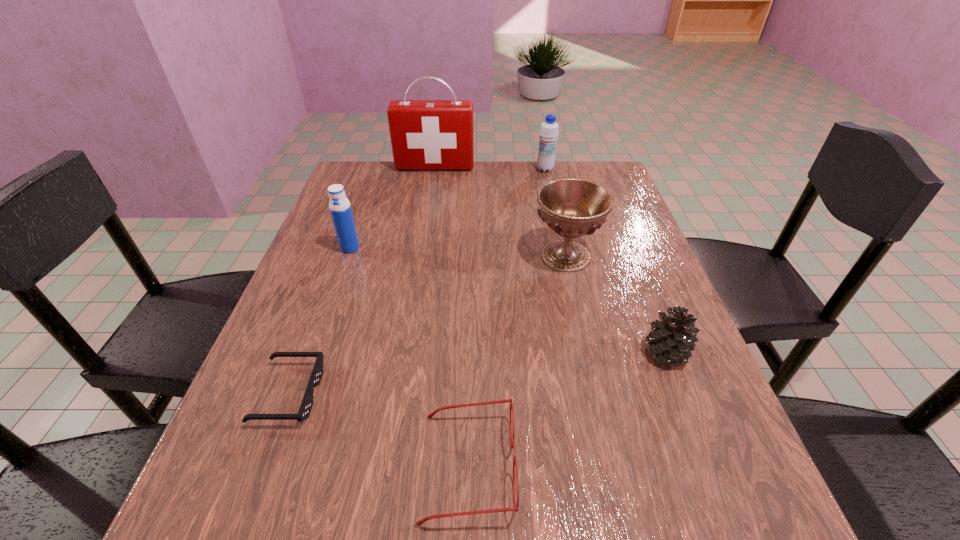
Find the location of `vacant space that satisfies the following two spatial constraints: 1. on the front face of the first-aid kit; 2. on the left side of the rightmost object`. vacant space that satisfies the following two spatial constraints: 1. on the front face of the first-aid kit; 2. on the left side of the rightmost object is located at coordinates (406, 352).